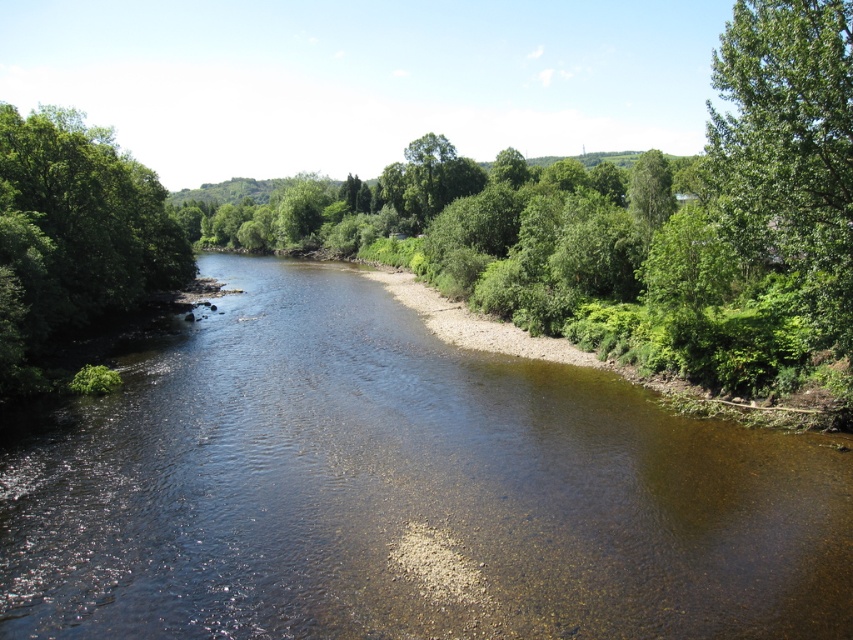
Question: Observing the image, what is the correct spatial positioning of green leafy tree at upper right in reference to green leafy tree at left?

Choices:
 (A) above
 (B) below

Answer: (B)

Question: Which object is farther from the camera taking this photo?

Choices:
 (A) clear water at center
 (B) green leafy tree at left
 (C) green leafy tree at upper right

Answer: (B)

Question: Does clear water at center have a larger size compared to green leafy tree at left?

Choices:
 (A) no
 (B) yes

Answer: (A)

Question: Is clear water at center above green leafy tree at left?

Choices:
 (A) yes
 (B) no

Answer: (B)

Question: Which of the following is the farthest from the observer?

Choices:
 (A) green leafy tree at left
 (B) clear water at center

Answer: (A)

Question: Which is farther from the green leafy tree at upper right?

Choices:
 (A) clear water at center
 (B) green leafy tree at left

Answer: (B)